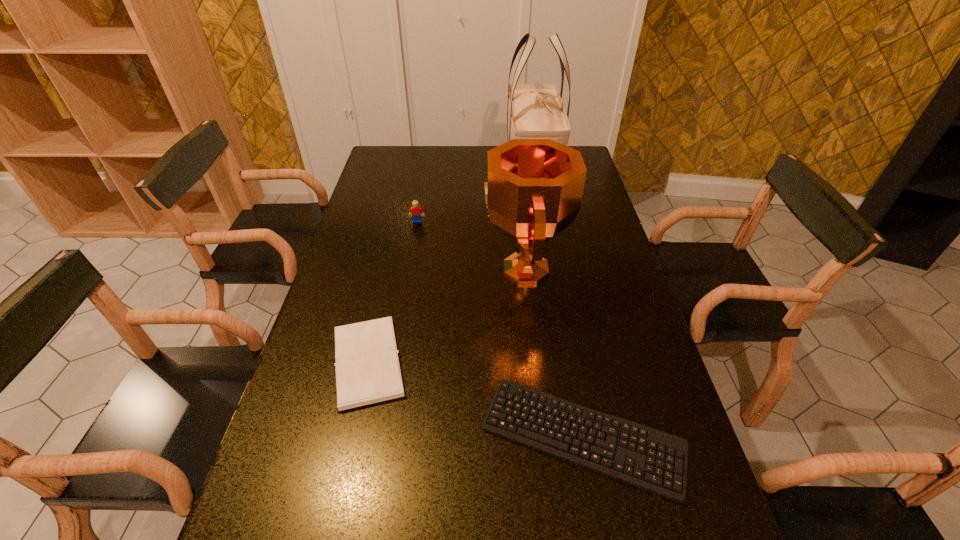
At what (x,y) coordinates should I click in order to perform the action: click on vacant space at the far edge of the desktop. Please return your answer as a coordinate pair (x, y). The height and width of the screenshot is (540, 960). Looking at the image, I should click on (418, 159).

In the image, there is a desktop. Identify the location of free space at the right edge. (655, 407).

The height and width of the screenshot is (540, 960). In order to click on free space at the far left corner of the desktop in this screenshot , I will do `click(389, 166)`.

This screenshot has height=540, width=960. In order to click on free space between the shortest object and the second tallest object in this screenshot , I will do `click(553, 353)`.

The width and height of the screenshot is (960, 540). In order to click on vacant space that's between the second shortest object and the third nearest object in this screenshot , I will do `click(446, 316)`.

You are a GUI agent. You are given a task and a screenshot of the screen. Output one action in this format:
    pyautogui.click(x=<x>, y=<y>)
    Task: Click on the vacant area that lies between the hardback book and the award
    
    Given the screenshot: What is the action you would take?
    pyautogui.click(x=446, y=316)

In order to click on vacant space that's between the shopping bag and the Lego in this screenshot , I will do `click(474, 197)`.

Where is `free spot between the third tallest object and the shortest object`? The image size is (960, 540). free spot between the third tallest object and the shortest object is located at coordinates (500, 329).

You are a GUI agent. You are given a task and a screenshot of the screen. Output one action in this format:
    pyautogui.click(x=<x>, y=<y>)
    Task: Click on the free spot between the shortest object and the award
    
    Given the screenshot: What is the action you would take?
    pyautogui.click(x=553, y=353)

Locate an element on the screen. vacant area that lies between the computer keyboard and the tallest object is located at coordinates (557, 305).